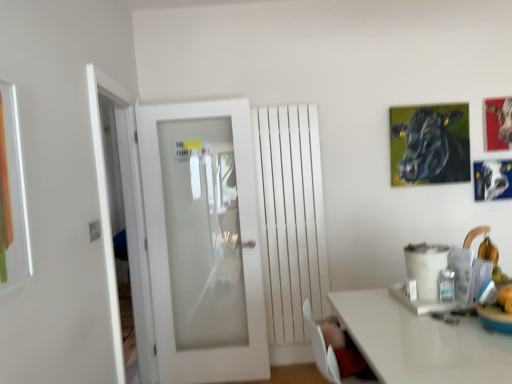
Image resolution: width=512 pixels, height=384 pixels. What do you see at coordinates (290, 217) in the screenshot?
I see `white matte radiator at center` at bounding box center [290, 217].

How much space does oil painting cow at upper right, which appears as the third picture frame when viewed from the right, occupy vertically?

It is 25.56 inches.

Identify the location of metallic silver picture frame at upper right, acting as the 2th picture frame starting from the right. Image resolution: width=512 pixels, height=384 pixels. (492, 179).

Locate an element on the screen. white frosted glass door at center is located at coordinates (203, 241).

Is point (304, 253) less distant than point (397, 172)?

Yes, it is in front of point (397, 172).

Based on the photo, which object is further away from the camera, white matte radiator at center or oil painting cow at upper right, which appears as the third picture frame when viewed from the right?

oil painting cow at upper right, which appears as the third picture frame when viewed from the right, is behind.

What's the angular difference between white matte radiator at center and oil painting cow at upper right, which is the 1th picture frame from left to right,'s facing directions?

0.618 degrees separate the facing orientations of white matte radiator at center and oil painting cow at upper right, which is the 1th picture frame from left to right.

Is white matte radiator at center looking in the opposite direction of oil painting cow at upper right, which is the 1th picture frame from left to right?

That's not correct — white matte radiator at center is not looking away from oil painting cow at upper right, which is the 1th picture frame from left to right.

Consider the image. Considering the sizes of objects white matte radiator at center and metallic silver picture frame at upper right, acting as the 2th picture frame starting from the right, in the image provided, who is wider, white matte radiator at center or metallic silver picture frame at upper right, acting as the 2th picture frame starting from the right,?

white matte radiator at center.

Is white matte radiator at center positioned far away from metallic silver picture frame at upper right, acting as the second picture frame starting from the left?

Absolutely, white matte radiator at center is distant from metallic silver picture frame at upper right, acting as the second picture frame starting from the left.

From the image's perspective, who appears lower, white matte radiator at center or metallic silver picture frame at upper right, acting as the second picture frame starting from the left?

white matte radiator at center appears lower in the image.

Is white frosted glass door at center next to oil painting cow at upper right, which appears as the third picture frame when viewed from the right, and touching it?

No.

Does white frosted glass door at center have a larger size compared to oil painting cow at upper right, which is the 1th picture frame from left to right?

Correct, white frosted glass door at center is larger in size than oil painting cow at upper right, which is the 1th picture frame from left to right.

From the image's perspective, which is above, white frosted glass door at center or oil painting cow at upper right, which is the 1th picture frame from left to right?

oil painting cow at upper right, which is the 1th picture frame from left to right, is shown above in the image.

Based on the photo, does white frosted glass door at center have a lesser width compared to oil painting cow at upper right, which is the 1th picture frame from left to right?

No, white frosted glass door at center is not thinner than oil painting cow at upper right, which is the 1th picture frame from left to right.

Considering their positions, is oil painting cow at upper right, which appears as the third picture frame when viewed from the right, located in front of or behind white frosted glass door at left?

oil painting cow at upper right, which appears as the third picture frame when viewed from the right, is positioned farther from the viewer than white frosted glass door at left.

Does oil painting cow at upper right, which appears as the third picture frame when viewed from the right, turn towards white frosted glass door at left?

No, oil painting cow at upper right, which appears as the third picture frame when viewed from the right, does not turn towards white frosted glass door at left.

From a real-world perspective, who is located higher, white frosted glass door at left or white frosted glass door at center?

In real-world perspective, white frosted glass door at left is above.

Considering the points (148, 337) and (213, 374), which point is behind, point (148, 337) or point (213, 374)?

The point (148, 337) is more distant.

Find the location of a particular element. door below the white frosted glass door at left (from a real-world perspective) is located at coordinates (203, 241).

Is white frosted glass door at left wider or thinner than white frosted glass door at center?

white frosted glass door at left is thinner than white frosted glass door at center.

Is point (487, 101) closer or farther from the camera than point (441, 105)?

Point (487, 101) is farther from the camera than point (441, 105).

Would you say metallic silver picture frame at upper right, arranged as the first picture frame when viewed from the right, contains oil painting cow at upper right, which appears as the third picture frame when viewed from the right?

That's incorrect, oil painting cow at upper right, which appears as the third picture frame when viewed from the right, is not inside metallic silver picture frame at upper right, arranged as the first picture frame when viewed from the right.

From the image's perspective, is metallic silver picture frame at upper right, arranged as the first picture frame when viewed from the right, located above or below oil painting cow at upper right, which is the 1th picture frame from left to right?

metallic silver picture frame at upper right, arranged as the first picture frame when viewed from the right, is above oil painting cow at upper right, which is the 1th picture frame from left to right.

Consider the image. From a real-world perspective, is metallic silver picture frame at upper right, which is counted as the third picture frame, starting from the left, positioned under oil painting cow at upper right, which is the 1th picture frame from left to right, based on gravity?

No, from a real-world perspective, metallic silver picture frame at upper right, which is counted as the third picture frame, starting from the left, is not beneath oil painting cow at upper right, which is the 1th picture frame from left to right.

Considering the positions of points (210, 329) and (477, 182), is point (210, 329) closer to camera compared to point (477, 182)?

That is False.

Is white frosted glass door at center facing away from metallic silver picture frame at upper right, acting as the second picture frame starting from the left?

That's not correct — white frosted glass door at center is not looking away from metallic silver picture frame at upper right, acting as the second picture frame starting from the left.

From the image's perspective, which is above, white frosted glass door at center or metallic silver picture frame at upper right, acting as the second picture frame starting from the left?

From the image's view, metallic silver picture frame at upper right, acting as the second picture frame starting from the left, is above.

Locate an element on the screen. the 1st picture frame to the right of the white matte radiator at center, starting your count from the anchor is located at coordinates (429, 144).

There is a white matte radiator at center. Identify the location of the 1st picture frame above it (from a real-world perspective). The height and width of the screenshot is (384, 512). (492, 179).

Considering their positions, is white frosted glass door at left positioned further to oil painting cow at upper right, which is the 1th picture frame from left to right, than metallic silver picture frame at upper right, acting as the 2th picture frame starting from the right?

white frosted glass door at left is positioned further to the anchor oil painting cow at upper right, which is the 1th picture frame from left to right.

In the scene shown: Which object lies nearer to the anchor point metallic silver picture frame at upper right, acting as the 2th picture frame starting from the right, white frosted glass door at left or oil painting cow at upper right, which appears as the third picture frame when viewed from the right?

Among the two, oil painting cow at upper right, which appears as the third picture frame when viewed from the right, is located nearer to metallic silver picture frame at upper right, acting as the 2th picture frame starting from the right.

Looking at this image, from the image, which object appears to be farther from oil painting cow at upper right, which appears as the third picture frame when viewed from the right, metallic silver picture frame at upper right, acting as the second picture frame starting from the left, or white frosted glass door at center?

white frosted glass door at center is positioned further to the anchor oil painting cow at upper right, which appears as the third picture frame when viewed from the right.

Looking at the image, which one is located closer to white frosted glass door at center, white frosted glass door at left or metallic silver picture frame at upper right, which is counted as the third picture frame, starting from the left?

Based on the image, white frosted glass door at left appears to be nearer to white frosted glass door at center.

Which object lies further to the anchor point metallic silver picture frame at upper right, acting as the second picture frame starting from the left, metallic silver picture frame at upper right, arranged as the first picture frame when viewed from the right, or white frosted glass door at left?

white frosted glass door at left is positioned further to the anchor metallic silver picture frame at upper right, acting as the second picture frame starting from the left.

Considering their positions, is metallic silver picture frame at upper right, which is counted as the third picture frame, starting from the left, positioned further to metallic silver picture frame at upper right, acting as the 2th picture frame starting from the right, than white matte radiator at center?

white matte radiator at center.

Based on their spatial positions, is white frosted glass door at center or metallic silver picture frame at upper right, arranged as the first picture frame when viewed from the right, closer to metallic silver picture frame at upper right, acting as the 2th picture frame starting from the right?

metallic silver picture frame at upper right, arranged as the first picture frame when viewed from the right.

From the image, which object appears to be nearer to white frosted glass door at center, metallic silver picture frame at upper right, acting as the second picture frame starting from the left, or white matte radiator at center?

white matte radiator at center is positioned closer to the anchor white frosted glass door at center.

Where is `picture frame between oil painting cow at upper right, which appears as the third picture frame when viewed from the right, and metallic silver picture frame at upper right, which is counted as the third picture frame, starting from the left, in the horizontal direction`? The image size is (512, 384). picture frame between oil painting cow at upper right, which appears as the third picture frame when viewed from the right, and metallic silver picture frame at upper right, which is counted as the third picture frame, starting from the left, in the horizontal direction is located at coordinates (492, 179).

Where is `radiator located between white frosted glass door at center and metallic silver picture frame at upper right, arranged as the first picture frame when viewed from the right, in the left-right direction`? This screenshot has height=384, width=512. radiator located between white frosted glass door at center and metallic silver picture frame at upper right, arranged as the first picture frame when viewed from the right, in the left-right direction is located at coordinates (290, 217).

Locate an element on the screen. This screenshot has height=384, width=512. door between white frosted glass door at left and metallic silver picture frame at upper right, acting as the second picture frame starting from the left is located at coordinates (203, 241).

Image resolution: width=512 pixels, height=384 pixels. What are the coordinates of `door between white frosted glass door at left and metallic silver picture frame at upper right, arranged as the first picture frame when viewed from the right` in the screenshot? It's located at (203, 241).